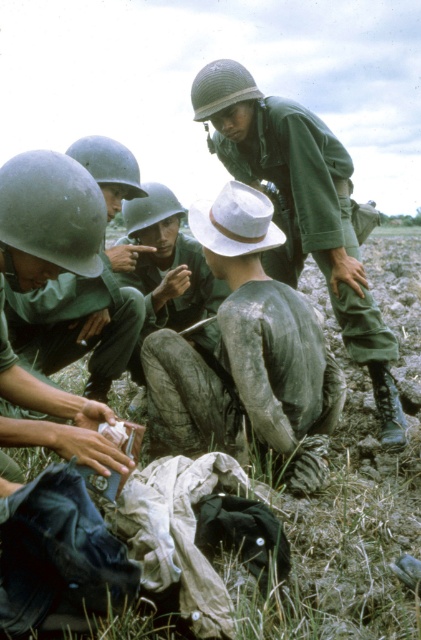
You are a soldier in the field and need to identify the shortest object between the worn canvas hat at center and the green matte helmet at upper center. Which one should you report?

The worn canvas hat at center is shorter than the green matte helmet at upper center, so you should report the worn canvas hat at center as the shortest object.

You are a military medic tasked with assessing the situation. You notice the worn canvas hat at center and the matte green helmet at lower left. Which object takes up more area in the image?

The matte green helmet at lower left takes up more area in the image than the worn canvas hat at center, as the worn canvas hat at center occupies less space than matte green helmet at lower left.